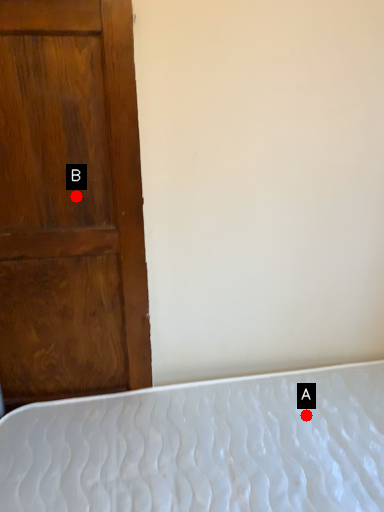
Question: Two points are circled on the image, labeled by A and B beside each circle. Which of the following is the closest to the observer?

Choices:
 (A) A is closer
 (B) B is closer

Answer: (B)